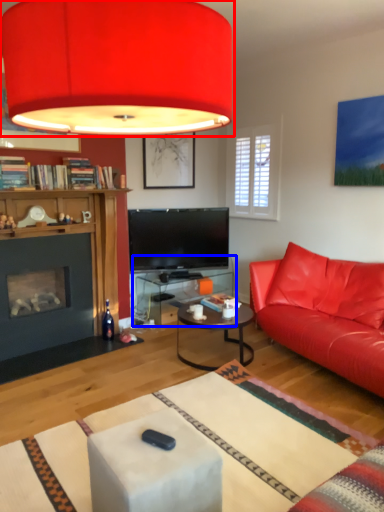
Question: Among these objects, which one is nearest to the camera, lamp (highlighted by a red box) or table (highlighted by a blue box)?

Choices:
 (A) lamp
 (B) table

Answer: (A)